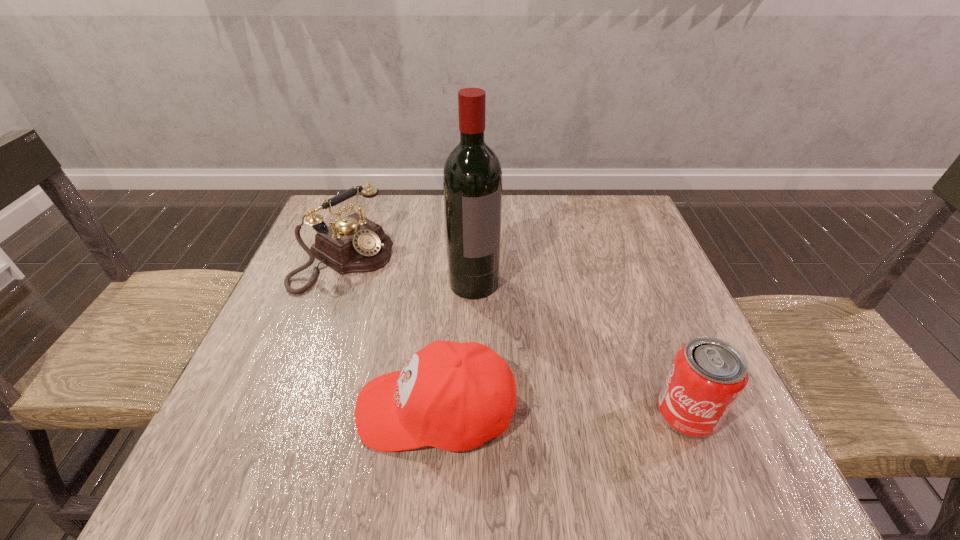
What are the coordinates of `baseball cap` in the screenshot? It's located at (454, 396).

Image resolution: width=960 pixels, height=540 pixels. I want to click on the rightmost object, so click(x=707, y=376).

I want to click on wine bottle, so click(x=472, y=177).

In order to click on telephone in this screenshot , I will do `click(354, 244)`.

Identify the location of free region located 0.060m on the front panel of the baseball cap. This screenshot has width=960, height=540. (324, 409).

At what (x,y) coordinates should I click in order to perform the action: click on vacant space situated on the front panel of the baseball cap. Please return your answer as a coordinate pair (x, y). The image size is (960, 540). Looking at the image, I should click on (257, 409).

Locate an element on the screen. free space located on the front panel of the baseball cap is located at coordinates (268, 409).

Locate an element on the screen. This screenshot has height=540, width=960. vacant region located on the back of the can is located at coordinates (640, 295).

What are the coordinates of `vacant space located on the label of the tallest object` in the screenshot? It's located at (564, 411).

In order to click on vacant region located on the label of the tallest object in this screenshot , I will do `click(527, 359)`.